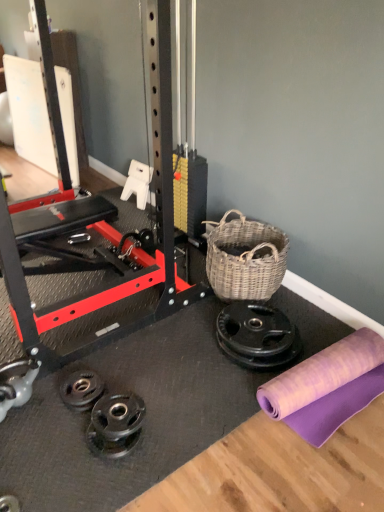
Question: Is purple fabric at lower right looking in the opposite direction of black rubber weight plate at lower left?

Choices:
 (A) yes
 (B) no

Answer: (B)

Question: Is purple fabric at lower right oriented towards black rubber weight plate at lower left?

Choices:
 (A) no
 (B) yes

Answer: (A)

Question: From a real-world perspective, is purple fabric at lower right positioned under black rubber weight plate at lower left based on gravity?

Choices:
 (A) no
 (B) yes

Answer: (A)

Question: Is purple fabric at lower right to the left of black rubber weight plate at lower left from the viewer's perspective?

Choices:
 (A) yes
 (B) no

Answer: (B)

Question: From a real-world perspective, is purple fabric at lower right physically above black rubber weight plate at lower left?

Choices:
 (A) no
 (B) yes

Answer: (B)

Question: From the image's perspective, does purple fabric at lower right appear lower than black rubber weight plate at lower left?

Choices:
 (A) no
 (B) yes

Answer: (A)

Question: Does woven natural basket at center-right have a lesser height compared to purple fabric at lower right?

Choices:
 (A) yes
 (B) no

Answer: (A)

Question: Is woven natural basket at center-right facing away from purple fabric at lower right?

Choices:
 (A) yes
 (B) no

Answer: (B)

Question: Does woven natural basket at center-right turn towards purple fabric at lower right?

Choices:
 (A) yes
 (B) no

Answer: (B)

Question: Is woven natural basket at center-right outside purple fabric at lower right?

Choices:
 (A) yes
 (B) no

Answer: (A)

Question: Is woven natural basket at center-right closer to camera compared to purple fabric at lower right?

Choices:
 (A) no
 (B) yes

Answer: (A)

Question: Is woven natural basket at center-right not close to purple fabric at lower right?

Choices:
 (A) no
 (B) yes

Answer: (A)

Question: Is purple fabric at lower right looking in the opposite direction of woven natural basket at center-right?

Choices:
 (A) yes
 (B) no

Answer: (B)